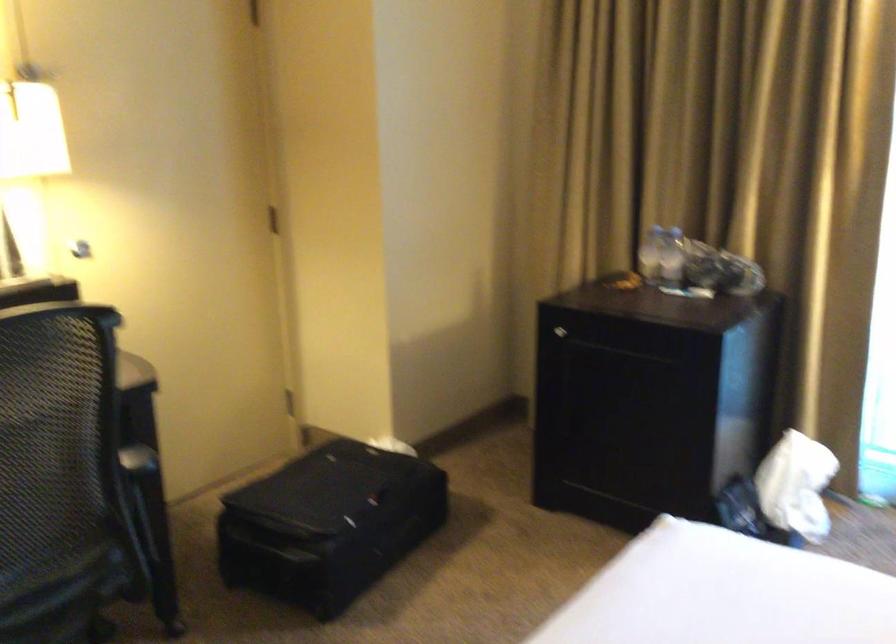
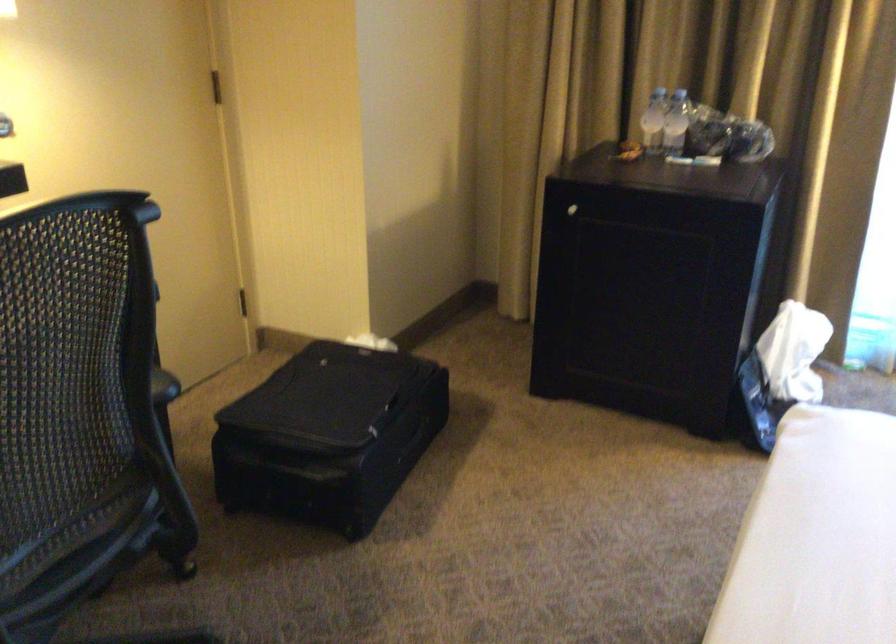
Where in the second image is the point corresponding to [563,332] from the first image?

(572, 210)